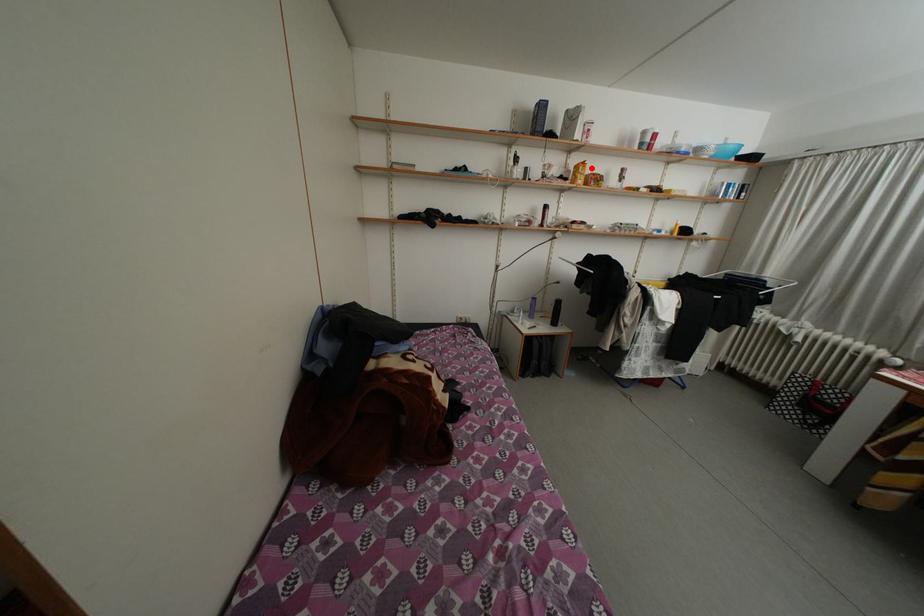
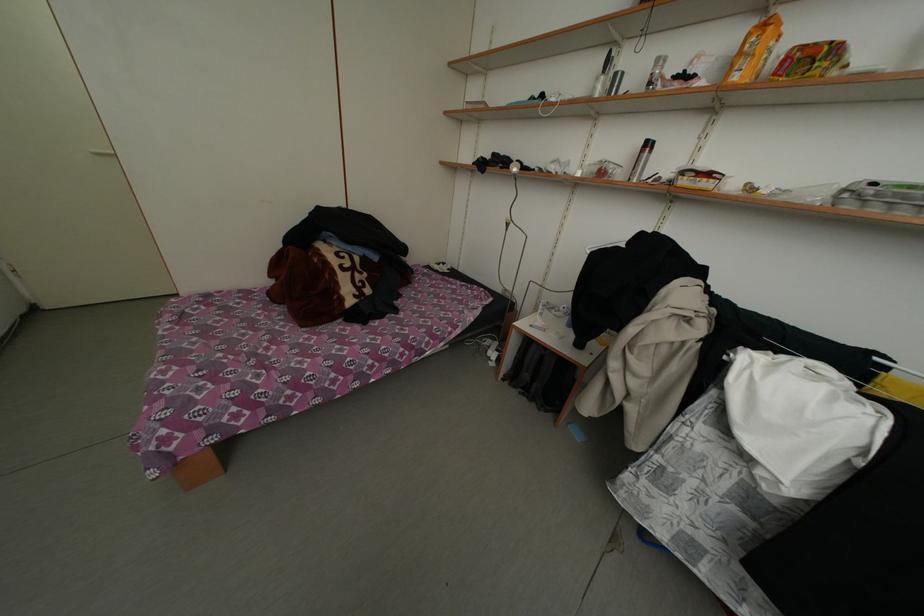
Find the pixel in the second image that matches the highlighted location in the first image.

(774, 29)